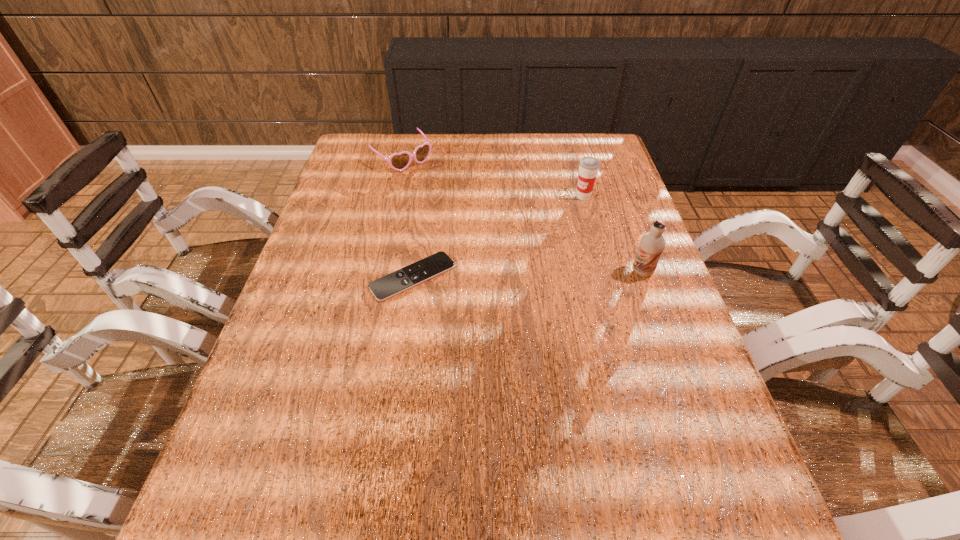
Where is `the shortest object`? The image size is (960, 540). the shortest object is located at coordinates (416, 273).

Find the location of a particular element. This screenshot has height=540, width=960. chocolate milk is located at coordinates (652, 244).

Identify the location of the third nearest object. (588, 166).

Image resolution: width=960 pixels, height=540 pixels. Find the location of `the second object from right to left`. the second object from right to left is located at coordinates (588, 166).

Find the location of a particular element. This screenshot has height=540, width=960. the farthest object is located at coordinates pos(400,161).

You are a GUI agent. You are given a task and a screenshot of the screen. Output one action in this format:
    pyautogui.click(x=<x>, y=<y>)
    Task: Click on the sunglasses
    The image size is (960, 540).
    Given the screenshot: What is the action you would take?
    pyautogui.click(x=400, y=161)

Image resolution: width=960 pixels, height=540 pixels. Identify the location of free space located on the back of the remote control. (420, 227).

Image resolution: width=960 pixels, height=540 pixels. What are the coordinates of `free region located 0.280m on the front of the chocolate milk` in the screenshot? It's located at (682, 383).

At what (x,y) coordinates should I click in order to perform the action: click on free region located on the side of the third nearest object with the logo. Please return your answer as a coordinate pair (x, y). The width and height of the screenshot is (960, 540). Looking at the image, I should click on (516, 277).

Locate an element on the screen. free point located 0.240m on the side of the third nearest object with the logo is located at coordinates click(541, 247).